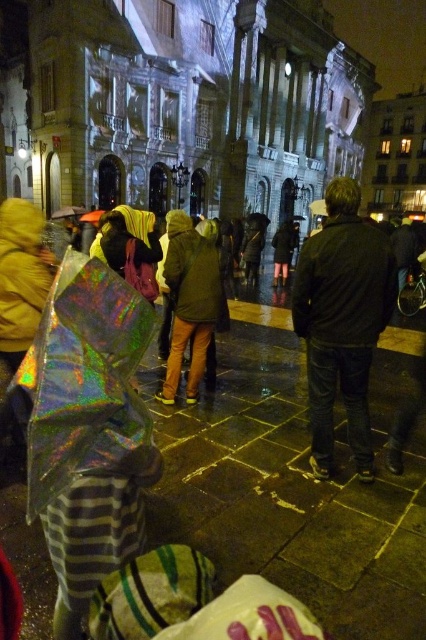
Does point (345, 500) lie in front of point (348, 336)?

That is True.

Who is higher up, holographic plastic bag at lower left or dark brown leather jacket at center?

dark brown leather jacket at center is above.

Which is behind, point (351, 557) or point (325, 376)?

The point (325, 376) is behind.

Find the location of a particular element. This screenshot has height=640, width=426. holographic plastic bag at lower left is located at coordinates (293, 486).

Measure the distance from holographic plastic bag at lower left to green matte jacket at center.

8.36 meters

Does holographic plastic bag at lower left have a greater width compared to green matte jacket at center?

Indeed, holographic plastic bag at lower left has a greater width compared to green matte jacket at center.

The image size is (426, 640). I want to click on holographic plastic bag at lower left, so click(x=293, y=486).

This screenshot has height=640, width=426. I want to click on holographic plastic bag at lower left, so click(x=293, y=486).

Between point (322, 435) and point (196, 244), which one is positioned behind?

Point (196, 244)

Who is more forward, (x=362, y=344) or (x=195, y=394)?

Positioned in front is point (x=362, y=344).

Find the location of a particular element. This screenshot has width=426, height=640. dark brown leather jacket at center is located at coordinates (342, 321).